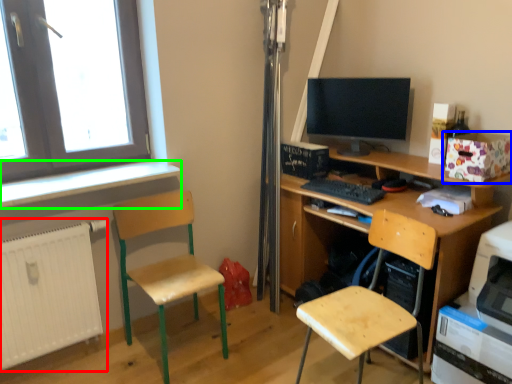
Question: Which object is the farthest from radiator (highlighted by a red box)? Choose among these: box (highlighted by a blue box) or window sill (highlighted by a green box).

Choices:
 (A) box
 (B) window sill

Answer: (A)